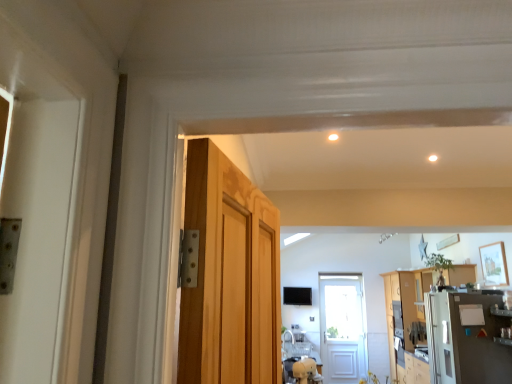
Question: Is satin silver refrigerator at right not close to white glossy light at upper center?

Choices:
 (A) no
 (B) yes

Answer: (B)

Question: From the image's perspective, is satin silver refrigerator at right on top of white glossy light at upper center?

Choices:
 (A) yes
 (B) no

Answer: (B)

Question: Is satin silver refrigerator at right completely or partially outside of white glossy light at upper center?

Choices:
 (A) no
 (B) yes

Answer: (B)

Question: Considering the relative sizes of satin silver refrigerator at right and white glossy light at upper center in the image provided, is satin silver refrigerator at right smaller than white glossy light at upper center?

Choices:
 (A) no
 (B) yes

Answer: (A)

Question: From a real-world perspective, is satin silver refrigerator at right over white glossy light at upper center?

Choices:
 (A) no
 (B) yes

Answer: (A)

Question: From the image's perspective, is satin silver refrigerator at right below white glossy light at upper center?

Choices:
 (A) yes
 (B) no

Answer: (A)

Question: Could you tell me if satin silver refrigerator at right is turned towards wooden cabinet at right?

Choices:
 (A) yes
 (B) no

Answer: (B)

Question: Is satin silver refrigerator at right smaller than wooden cabinet at right?

Choices:
 (A) yes
 (B) no

Answer: (A)

Question: Is satin silver refrigerator at right not close to wooden cabinet at right?

Choices:
 (A) no
 (B) yes

Answer: (A)

Question: Is satin silver refrigerator at right shorter than wooden cabinet at right?

Choices:
 (A) yes
 (B) no

Answer: (A)

Question: Is satin silver refrigerator at right completely or partially outside of wooden cabinet at right?

Choices:
 (A) no
 (B) yes

Answer: (B)

Question: Considering the relative sizes of satin silver refrigerator at right and wooden cabinet at right in the image provided, is satin silver refrigerator at right bigger than wooden cabinet at right?

Choices:
 (A) no
 (B) yes

Answer: (A)

Question: Can you confirm if wooden cabinet at right is shorter than satin silver refrigerator at right?

Choices:
 (A) yes
 (B) no

Answer: (B)